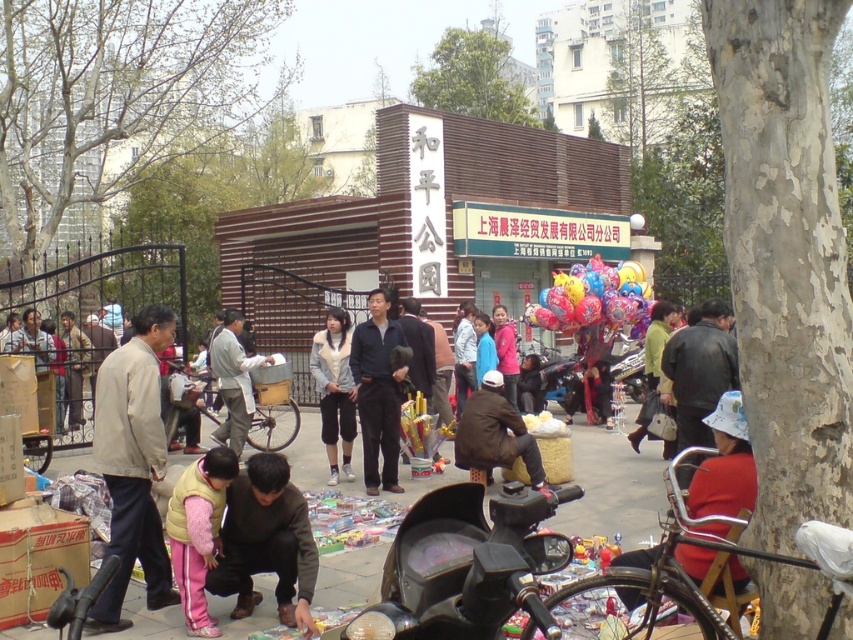
Based on the photo, between pink fleece vest at lower center and white fleece jacket at center, which one has less height?

pink fleece vest at lower center is shorter.

Is point (225, 464) positioned in front of point (318, 358)?

Yes, point (225, 464) is closer to viewer.

Where is `pink fleece vest at lower center`? pink fleece vest at lower center is located at coordinates tap(198, 531).

Between point (366, 467) and point (570, 273), which one is positioned behind?

Point (570, 273)

Is dark blue fleece jacket at center positioned in front of glossy plastic balloons at center?

That is True.

Between point (381, 417) and point (560, 330), which one is positioned in front?

Point (381, 417) is in front.

The image size is (853, 640). I want to click on dark blue fleece jacket at center, so click(378, 392).

Is dark gray fabric jacket at lower center taller than light gray fabric jacket at center?

No, dark gray fabric jacket at lower center is not taller than light gray fabric jacket at center.

At what (x,y) coordinates should I click in order to perform the action: click on dark gray fabric jacket at lower center. Please return your answer as a coordinate pair (x, y). Looking at the image, I should click on (265, 541).

I want to click on dark gray fabric jacket at lower center, so click(x=265, y=541).